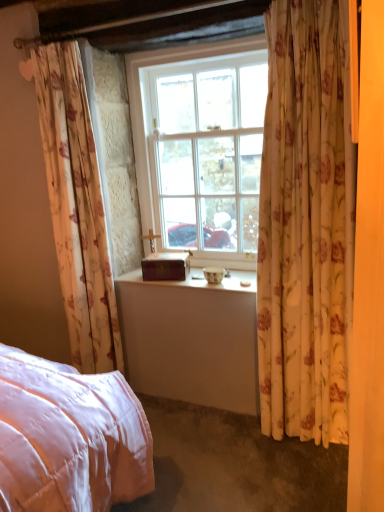
Question: Does white glass window at center have a lesser height compared to floral fabric curtain at right, marked as the 2th curtain in a left-to-right arrangement?

Choices:
 (A) no
 (B) yes

Answer: (B)

Question: From the image's perspective, is white glass window at center under floral fabric curtain at right, the 1th curtain from the right?

Choices:
 (A) yes
 (B) no

Answer: (B)

Question: From a real-world perspective, is white glass window at center on floral fabric curtain at right, marked as the 2th curtain in a left-to-right arrangement?

Choices:
 (A) no
 (B) yes

Answer: (B)

Question: Does white glass window at center come in front of floral fabric curtain at right, the 1th curtain from the right?

Choices:
 (A) no
 (B) yes

Answer: (A)

Question: Is white glass window at center thinner than floral fabric curtain at right, marked as the 2th curtain in a left-to-right arrangement?

Choices:
 (A) yes
 (B) no

Answer: (A)

Question: From a real-world perspective, does white glass window at center sit lower than floral fabric curtain at right, the 1th curtain from the right?

Choices:
 (A) no
 (B) yes

Answer: (A)

Question: Is white glass window at center bigger than wooden box at center?

Choices:
 (A) yes
 (B) no

Answer: (A)

Question: Is white glass window at center closer to the viewer compared to wooden box at center?

Choices:
 (A) yes
 (B) no

Answer: (A)

Question: Is white glass window at center surrounding wooden box at center?

Choices:
 (A) no
 (B) yes

Answer: (A)

Question: Does white glass window at center have a smaller size compared to wooden box at center?

Choices:
 (A) yes
 (B) no

Answer: (B)

Question: Is white glass window at center thinner than wooden box at center?

Choices:
 (A) yes
 (B) no

Answer: (A)

Question: Are white glass window at center and wooden box at center beside each other?

Choices:
 (A) no
 (B) yes

Answer: (A)

Question: Is floral fabric curtain at left, the 2th curtain from the right, smaller than floral fabric curtain at right, the 1th curtain from the right?

Choices:
 (A) yes
 (B) no

Answer: (B)